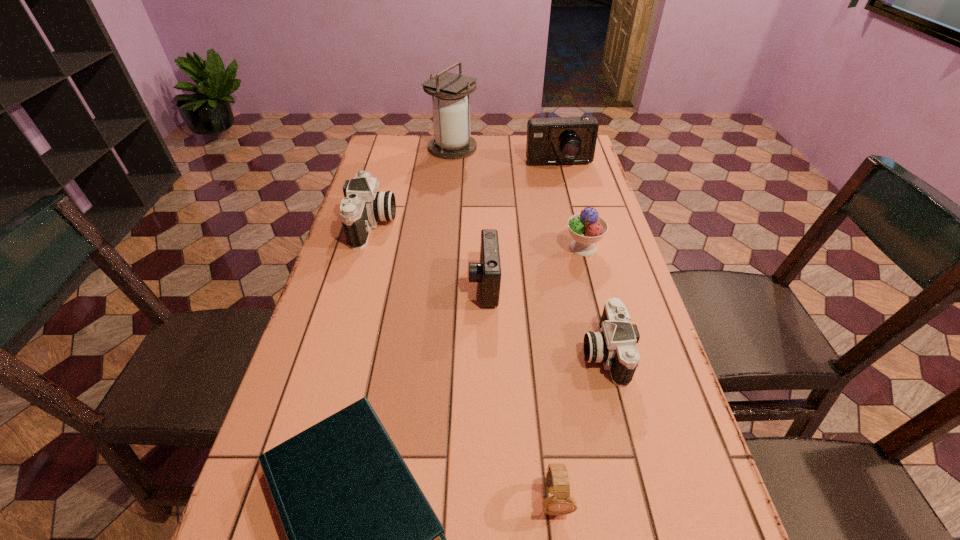
Identify the location of the second shortest object. (558, 501).

Where is `watch`? This screenshot has height=540, width=960. watch is located at coordinates (558, 501).

Locate an element on the screen. The image size is (960, 540). vacant region located on the front of the lantern is located at coordinates click(449, 184).

Image resolution: width=960 pixels, height=540 pixels. I want to click on free spot located on the front-facing side of the farthest camera, so pos(569,207).

This screenshot has width=960, height=540. Find the location of `blank space located on the front of the third nearest camera`. blank space located on the front of the third nearest camera is located at coordinates (345, 322).

Where is `vacant space located 0.310m on the left of the icecream`? vacant space located 0.310m on the left of the icecream is located at coordinates (454, 248).

Find the location of a particular element. This screenshot has height=540, width=960. vacant space located on the front-facing side of the nearer blue camera is located at coordinates (403, 284).

The height and width of the screenshot is (540, 960). Find the location of `vacant space located on the front-facing side of the nearer blue camera`. vacant space located on the front-facing side of the nearer blue camera is located at coordinates (426, 284).

Find the location of a particular element. Image resolution: width=960 pixels, height=540 pixels. vacant area located on the front-facing side of the nearer blue camera is located at coordinates (419, 284).

Locate an element on the screen. The width and height of the screenshot is (960, 540). vacant space located 0.060m on the right of the nearest camera is located at coordinates (653, 352).